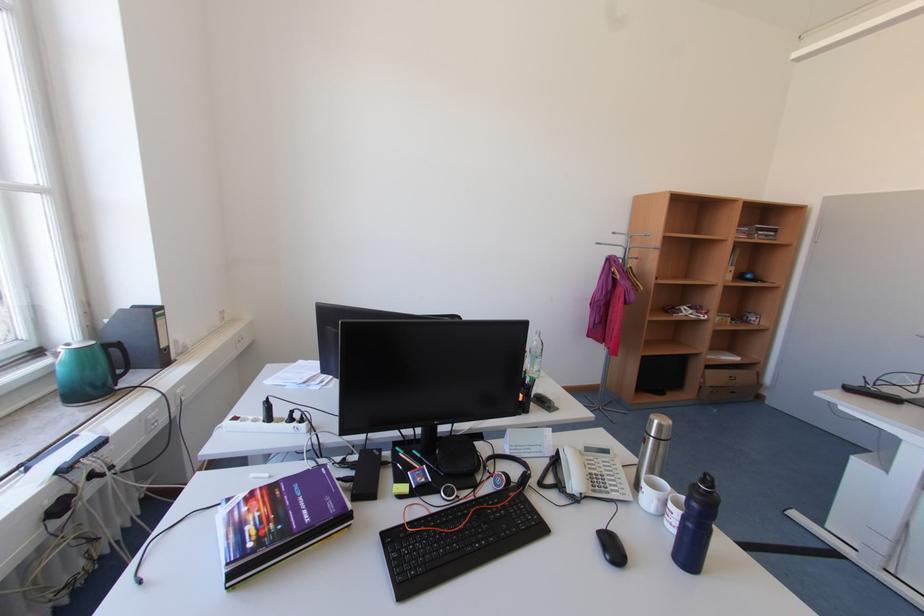
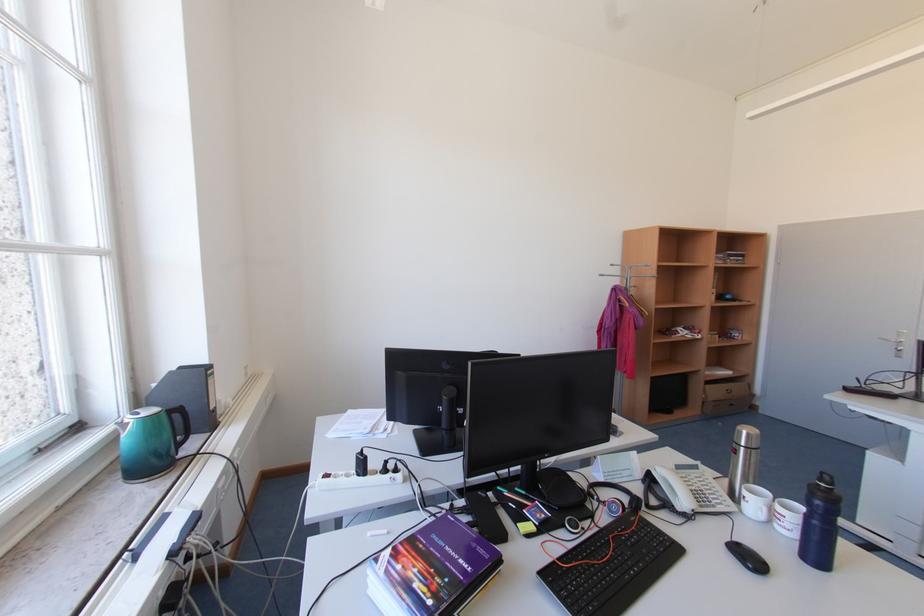
Locate, in the second image, the point that corresponds to (x=611, y=243) in the first image.

(613, 275)